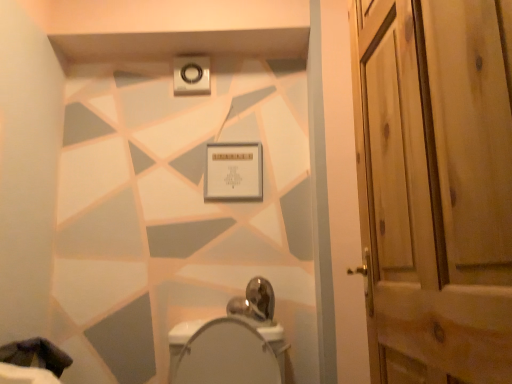
Locate an element on the screen. The height and width of the screenshot is (384, 512). dark fabric at lower left is located at coordinates (36, 355).

In order to face dark fabric at lower left, should I rotate leftwards or rightwards?

You should rotate left by 28.671 degrees.

Find the location of a particular element. This screenshot has height=384, width=512. white glossy bidet at center is located at coordinates point(217,326).

What do you see at coordinates (435, 186) in the screenshot?
I see `wooden door at right` at bounding box center [435, 186].

This screenshot has height=384, width=512. I want to click on dark fabric at lower left, so click(36, 355).

Can we say wooden door at right lies outside white glossy bidet at center?

Yes.

Is wooden door at right directly adjacent to white glossy bidet at center?

wooden door at right and white glossy bidet at center are not in contact.

Is wooden door at right oriented away from white glossy bidet at center?

No, wooden door at right is not facing away from white glossy bidet at center.

From a real-world perspective, does wooden door at right sit lower than white glossy bidet at center?

Incorrect, from a real-world perspective, wooden door at right is higher than white glossy bidet at center.

Considering the sizes of dark fabric at lower left and wooden door at right in the image, is dark fabric at lower left taller or shorter than wooden door at right?

In the image, dark fabric at lower left appears to be shorter than wooden door at right.

What's the angular difference between dark fabric at lower left and wooden door at right's facing directions?

175 degrees separate the facing orientations of dark fabric at lower left and wooden door at right.

Is dark fabric at lower left inside or outside of wooden door at right?

dark fabric at lower left lies outside wooden door at right.

Considering the points (58, 373) and (469, 11), which point is in front, point (58, 373) or point (469, 11)?

Point (469, 11)

Considering the positions of objects white glossy bidet at center and wooden door at right in the image provided, who is more to the right, white glossy bidet at center or wooden door at right?

wooden door at right is more to the right.

Can you confirm if white glossy bidet at center is wider than wooden door at right?

Correct, the width of white glossy bidet at center exceeds that of wooden door at right.

Based on the photo, is white glossy bidet at center further to the viewer compared to wooden door at right?

Yes, it is.

Considering the positions of point (231, 323) and point (383, 212), is point (231, 323) closer or farther from the camera than point (383, 212)?

Point (231, 323) is farther from the camera than point (383, 212).

From the image's perspective, is white glossy bidet at center located above dark fabric at lower left?

Correct, white glossy bidet at center appears higher than dark fabric at lower left in the image.

Looking at their sizes, would you say white glossy bidet at center is wider or thinner than dark fabric at lower left?

Clearly, white glossy bidet at center has more width compared to dark fabric at lower left.

From their relative heights in the image, would you say white glossy bidet at center is taller or shorter than dark fabric at lower left?

white glossy bidet at center is taller than dark fabric at lower left.

Can you confirm if dark fabric at lower left is smaller than white glossy bidet at center?

Indeed, dark fabric at lower left has a smaller size compared to white glossy bidet at center.

From the image's perspective, is dark fabric at lower left under white glossy bidet at center?

Yes, from the image's perspective, dark fabric at lower left is beneath white glossy bidet at center.

Between dark fabric at lower left and white glossy bidet at center, which one has smaller width?

With smaller width is dark fabric at lower left.

Where is `bidet that appears above the dark fabric at lower left (from the image's perspective)`? This screenshot has height=384, width=512. bidet that appears above the dark fabric at lower left (from the image's perspective) is located at coordinates (217, 326).

Is point (449, 295) positioned before point (68, 357)?

Yes, it is in front of point (68, 357).

Is wooden door at right facing towards dark fabric at lower left?

No, wooden door at right does not turn towards dark fabric at lower left.

Looking at this image, in the image, is wooden door at right on the left side or the right side of dark fabric at lower left?

From the image, it's evident that wooden door at right is to the right of dark fabric at lower left.

Identify the location of bidet that appears below the wooden door at right (from the image's perspective). The width and height of the screenshot is (512, 384). (217, 326).

At what (x,y) coordinates should I click in order to perform the action: click on laundry on the left of wooden door at right. Please return your answer as a coordinate pair (x, y). This screenshot has height=384, width=512. Looking at the image, I should click on (36, 355).

From the image, which object appears to be farther from dark fabric at lower left, white glossy bidet at center or wooden door at right?

wooden door at right is positioned further to the anchor dark fabric at lower left.

From the image, which object appears to be nearer to dark fabric at lower left, wooden door at right or white glossy bidet at center?

white glossy bidet at center lies closer to dark fabric at lower left than the other object.

Which object lies further to the anchor point wooden door at right, dark fabric at lower left or white glossy bidet at center?

dark fabric at lower left is positioned further to the anchor wooden door at right.

Which object lies further to the anchor point white glossy bidet at center, wooden door at right or dark fabric at lower left?

wooden door at right is further to white glossy bidet at center.

Consider the image. Considering their positions, is white glossy bidet at center positioned closer to wooden door at right than dark fabric at lower left?

white glossy bidet at center.

Looking at the image, which one is located further to white glossy bidet at center, dark fabric at lower left or wooden door at right?

wooden door at right is further to white glossy bidet at center.

Identify the location of bidet between dark fabric at lower left and wooden door at right. (217, 326).